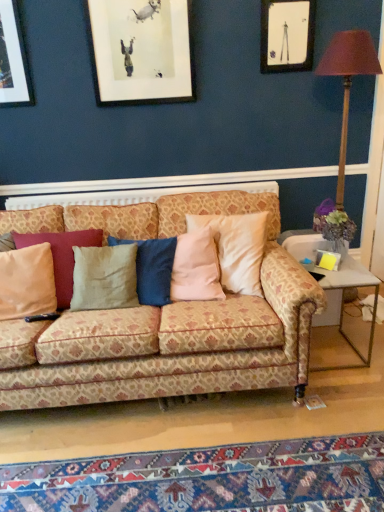
The height and width of the screenshot is (512, 384). In order to click on free area below metal/glass side table at lower right (from a real-world perspective) in this screenshot , I will do `click(327, 351)`.